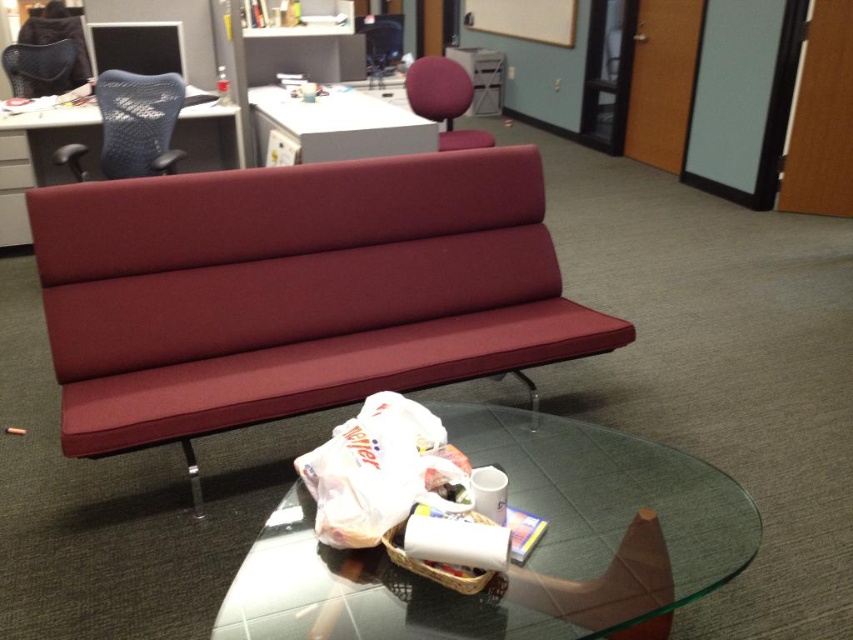
Is matte plastic table at upper center behind white glossy table at upper center?

Yes, matte plastic table at upper center is further from the viewer.

In order to click on matte plastic table at upper center in this screenshot , I will do `click(39, 160)`.

Between burgundy fabric couch at center and matte plastic table at upper center, which one appears on the left side from the viewer's perspective?

matte plastic table at upper center

Does burgundy fabric couch at center appear under matte plastic table at upper center?

Correct, burgundy fabric couch at center is located below matte plastic table at upper center.

Who is more distant from viewer, [398,294] or [91,106]?

The point [91,106] is more distant.

Image resolution: width=853 pixels, height=640 pixels. Identify the location of burgundy fabric couch at center. (294, 291).

Between point (650, 476) and point (47, 60), which one is positioned in front?

Point (650, 476) is in front.

Does transparent glass table at center come behind matte black chair at upper left?

No, transparent glass table at center is closer to the viewer.

Does point (296, 620) lie in front of point (33, 83)?

Yes, point (296, 620) is in front of point (33, 83).

Image resolution: width=853 pixels, height=640 pixels. What are the coordinates of `transparent glass table at center` in the screenshot? It's located at (523, 561).